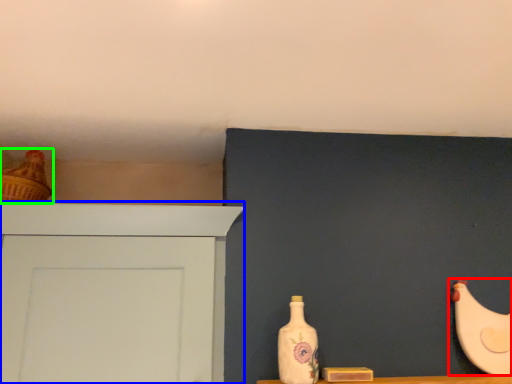
Question: Which object is positioned closest to chicken (highlighted by a red box)? Select from door (highlighted by a blue box) and chicken (highlighted by a green box).

Choices:
 (A) door
 (B) chicken

Answer: (A)